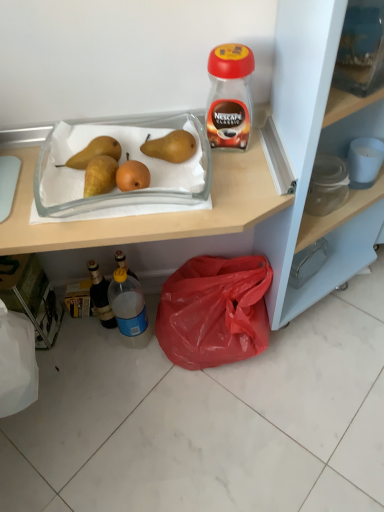
Find the location of a particular element. The image size is (384, 512). free space on the front side of brown matte pear at upper center, marked as the first pear in a right-to-left arrangement is located at coordinates (170, 190).